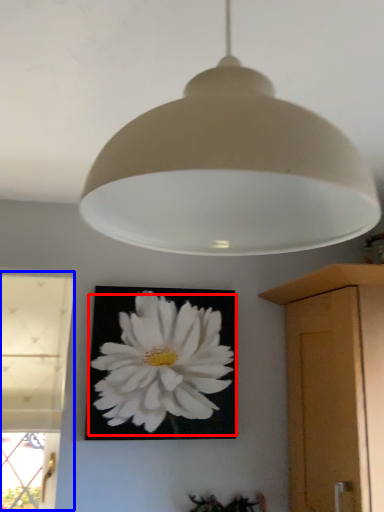
Question: Which object appears closest to the camera in this image, flower (highlighted by a red box) or window (highlighted by a blue box)?

Choices:
 (A) flower
 (B) window

Answer: (B)